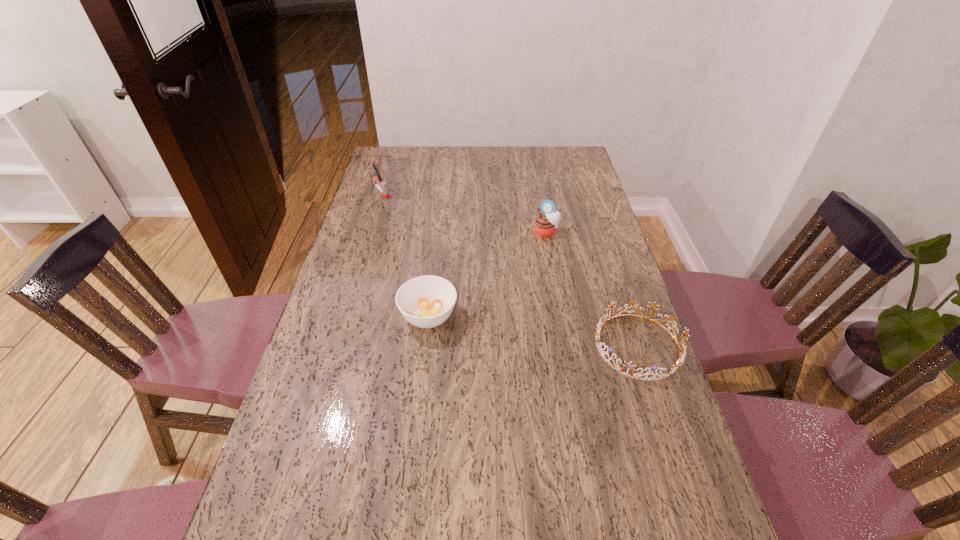
Where is `empty location between the rightmost object and the second object from left to right`? The width and height of the screenshot is (960, 540). empty location between the rightmost object and the second object from left to right is located at coordinates (533, 331).

This screenshot has height=540, width=960. Find the location of `free spot between the third object from right to left and the farthest object`. free spot between the third object from right to left and the farthest object is located at coordinates (405, 253).

Identify the location of free point between the third object from right to left and the muffin. The width and height of the screenshot is (960, 540). (488, 274).

You are a GUI agent. You are given a task and a screenshot of the screen. Output one action in this format:
    pyautogui.click(x=<x>, y=<y>)
    Task: Click on the vacant space that is in between the third shortest object and the rightmost object
    
    Given the screenshot: What is the action you would take?
    509,268

Identify which object is the nearest to the second object from left to right. Please provide its 2D coordinates. Your answer should be formatted as a tuple, i.e. [(x, y)], where the tuple contains the x and y coordinates of a point satisfying the conditions above.

[(680, 360)]

Identify which object is located as the second nearest to the soup bowl. Please provide its 2D coordinates. Your answer should be formatted as a tuple, i.e. [(x, y)], where the tuple contains the x and y coordinates of a point satisfying the conditions above.

[(545, 223)]

The height and width of the screenshot is (540, 960). I want to click on free space that satisfies the following two spatial constraints: 1. on the back side of the soup bowl; 2. on the right side of the third nearest object, so click(439, 231).

Where is `vacant position in the image that satisfies the following two spatial constraints: 1. on the front side of the leftmost object; 2. on the front-facing side of the rightmost object`? vacant position in the image that satisfies the following two spatial constraints: 1. on the front side of the leftmost object; 2. on the front-facing side of the rightmost object is located at coordinates (334, 346).

Locate an element on the screen. This screenshot has width=960, height=540. vacant space that satisfies the following two spatial constraints: 1. on the front side of the tiara; 2. on the front-facing side of the third object from right to left is located at coordinates (425, 346).